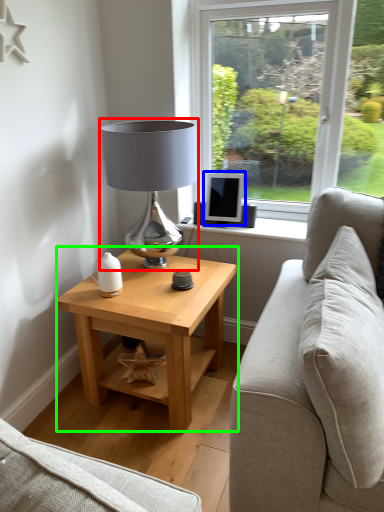
Question: Which is nearer to the table lamp (highlighted by a red box)? computer monitor (highlighted by a blue box) or table (highlighted by a green box).

Choices:
 (A) computer monitor
 (B) table

Answer: (A)